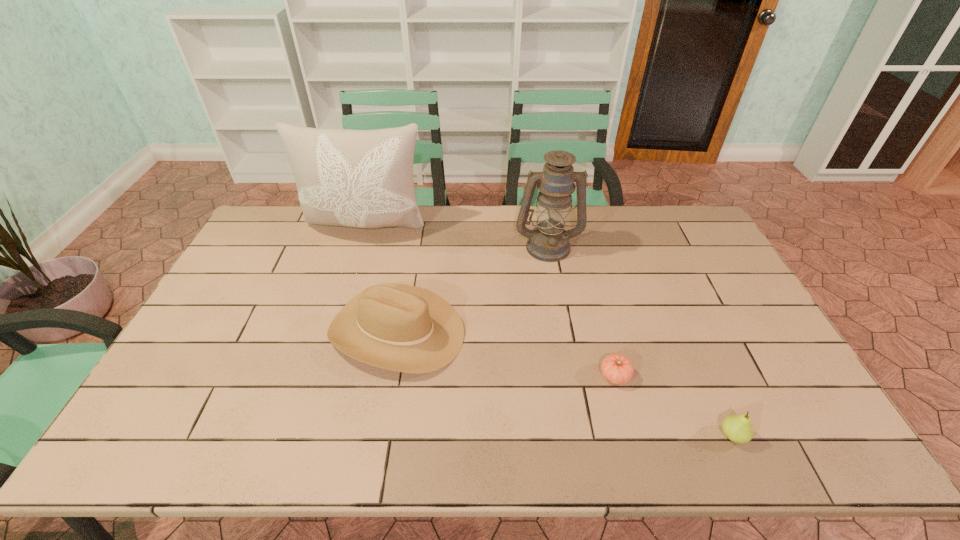
The width and height of the screenshot is (960, 540). Identify the location of free region located on the right of the shortest object. (696, 375).

This screenshot has height=540, width=960. Find the location of `cushion located in the far edge section of the desktop`. cushion located in the far edge section of the desktop is located at coordinates (357, 178).

Where is `oil lamp that is at the far edge`? oil lamp that is at the far edge is located at coordinates (549, 242).

Where is `object that is at the near edge`? The height and width of the screenshot is (540, 960). object that is at the near edge is located at coordinates (738, 428).

Identify the location of vacant space at the far edge of the desktop. The width and height of the screenshot is (960, 540). (596, 220).

In order to click on free location at the near edge in this screenshot , I will do `click(313, 450)`.

Image resolution: width=960 pixels, height=540 pixels. I want to click on vacant space at the left edge, so tap(202, 340).

This screenshot has height=540, width=960. I want to click on free space at the right edge, so click(x=693, y=259).

In the image, there is a desktop. Where is `vacant space at the near left corner`? Image resolution: width=960 pixels, height=540 pixels. vacant space at the near left corner is located at coordinates tap(156, 440).

Identify the location of free space between the shortest object and the cowboy hat. The width and height of the screenshot is (960, 540). (506, 353).